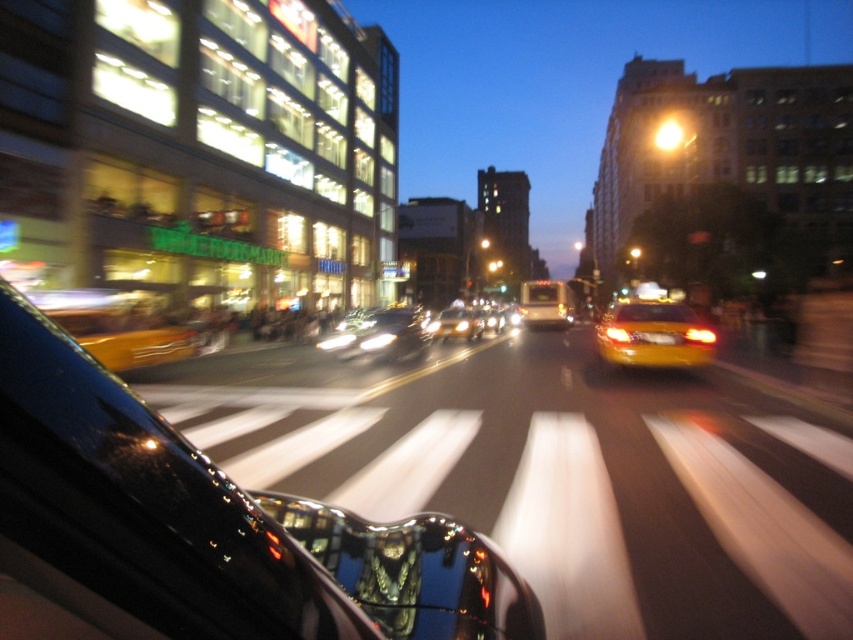
Question: Can you confirm if glossy black car at center is thinner than yellow matte taxi at left?

Choices:
 (A) no
 (B) yes

Answer: (A)

Question: Considering the relative positions of yellow matte taxi at left and shiny silver car at center in the image provided, where is yellow matte taxi at left located with respect to shiny silver car at center?

Choices:
 (A) above
 (B) below

Answer: (A)

Question: Does yellow matte taxi at left have a larger size compared to shiny silver sedan at center?

Choices:
 (A) no
 (B) yes

Answer: (B)

Question: Estimate the real-world distances between objects in this image. Which object is farther from the shiny silver sedan at center?

Choices:
 (A) yellow matte taxi at left
 (B) glossy black car at center
 (C) yellow matte taxi at center-right
 (D) shiny silver car at center

Answer: (B)

Question: Estimate the real-world distances between objects in this image. Which object is farther from the shiny silver car at center?

Choices:
 (A) shiny silver sedan at center
 (B) yellow matte taxi at left
 (C) yellow matte taxi at center-right

Answer: (C)

Question: Estimate the real-world distances between objects in this image. Which object is closer to the yellow matte taxi at left?

Choices:
 (A) shiny silver sedan at center
 (B) shiny silver car at center
 (C) yellow matte taxi at center-right

Answer: (B)